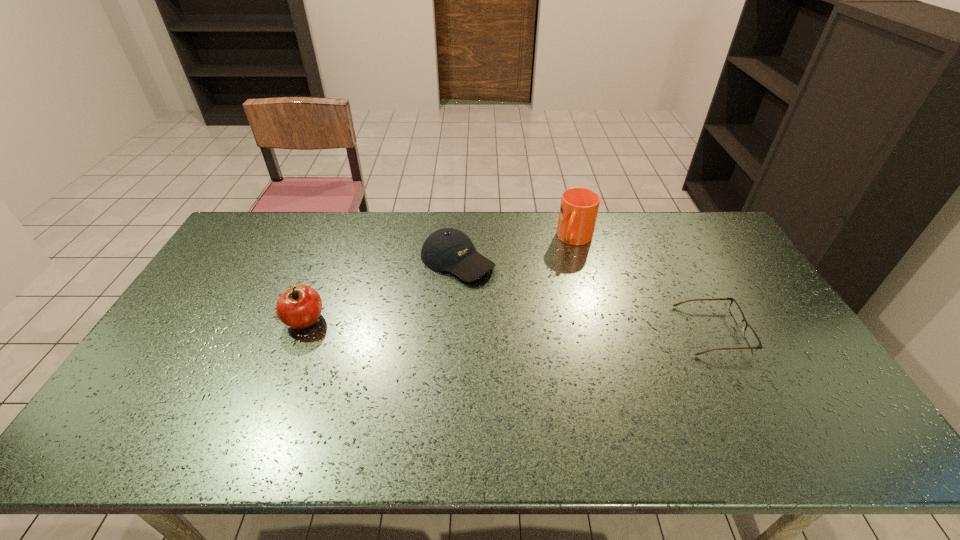
Where is `the third shortest object`? the third shortest object is located at coordinates (299, 307).

This screenshot has width=960, height=540. I want to click on the leftmost object, so click(x=299, y=307).

Image resolution: width=960 pixels, height=540 pixels. In order to click on the shortest object in this screenshot , I will do `click(751, 337)`.

You are a GUI agent. You are given a task and a screenshot of the screen. Output one action in this format:
    pyautogui.click(x=<x>, y=<y>)
    Task: Click on the spectacles
    
    Given the screenshot: What is the action you would take?
    pyautogui.click(x=751, y=337)

You are a GUI agent. You are given a task and a screenshot of the screen. Output one action in this format:
    pyautogui.click(x=<x>, y=<y>)
    Task: Click on the mug
    
    Given the screenshot: What is the action you would take?
    pyautogui.click(x=579, y=206)

I want to click on the tallest object, so click(579, 206).

Where is `the second object from left to right`? The width and height of the screenshot is (960, 540). the second object from left to right is located at coordinates (448, 249).

Image resolution: width=960 pixels, height=540 pixels. Identify the location of baseball cap. (448, 249).

Where is `vacant space situated on the left of the apple`? vacant space situated on the left of the apple is located at coordinates (229, 320).

Where is `vacant region located 0.110m on the front-facing side of the rightmost object`? Image resolution: width=960 pixels, height=540 pixels. vacant region located 0.110m on the front-facing side of the rightmost object is located at coordinates (780, 330).